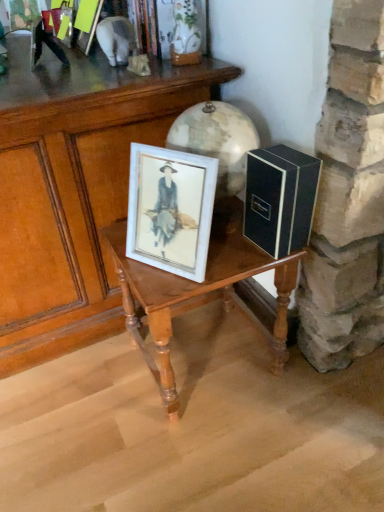
Locate an element on the screen. The image size is (384, 512). vacant area that lies to the right of wooden table at center, marked as the first table in a right-to-left arrangement is located at coordinates (325, 395).